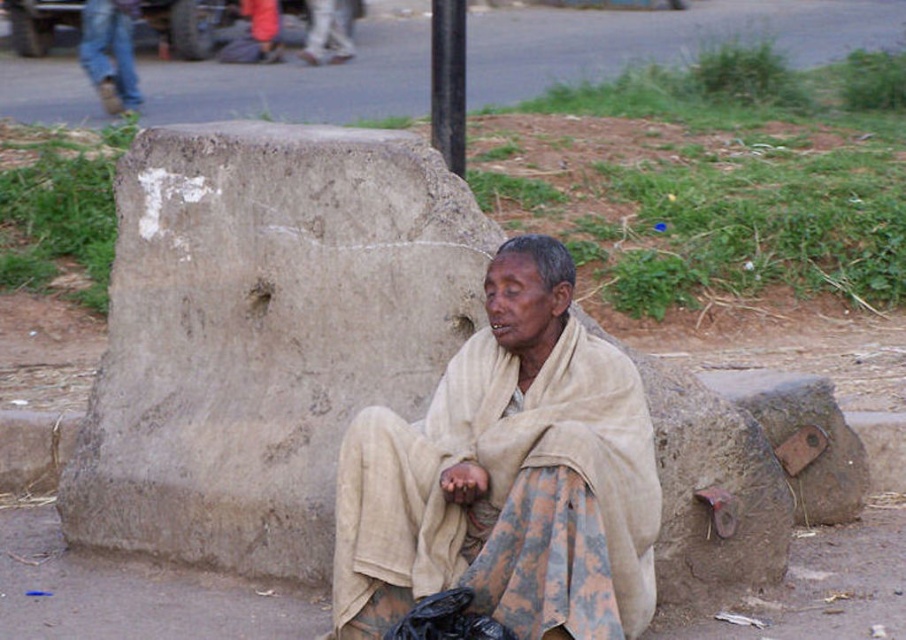
Question: Considering the relative positions of gray concrete pavement at upper center and black metal pole at upper center in the image provided, where is gray concrete pavement at upper center located with respect to black metal pole at upper center?

Choices:
 (A) right
 (B) left

Answer: (A)

Question: Which is farther from the black metal pole at upper center?

Choices:
 (A) gray concrete pavement at upper center
 (B) beige fabric at center

Answer: (A)

Question: Does gray concrete block at center have a smaller size compared to gray concrete pavement at upper center?

Choices:
 (A) no
 (B) yes

Answer: (B)

Question: Does gray concrete block at center appear on the left side of beige fabric at center?

Choices:
 (A) yes
 (B) no

Answer: (A)

Question: Which object appears closest to the camera in this image?

Choices:
 (A) gray concrete pavement at upper center
 (B) black metal pole at upper center

Answer: (B)

Question: Which is farther from the gray concrete block at center?

Choices:
 (A) beige fabric at center
 (B) black metal pole at upper center

Answer: (B)